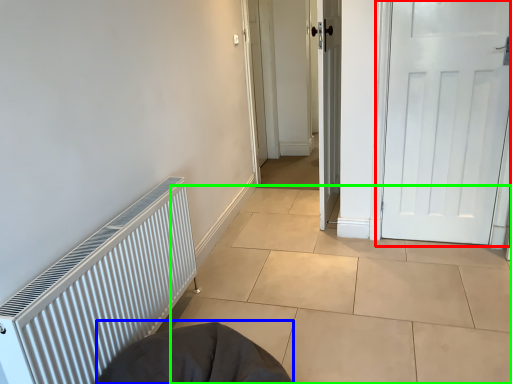
Question: Which is nearer to the door (highlighted by a red box)? sleeping bag (highlighted by a blue box) or tile (highlighted by a green box).

Choices:
 (A) sleeping bag
 (B) tile

Answer: (B)